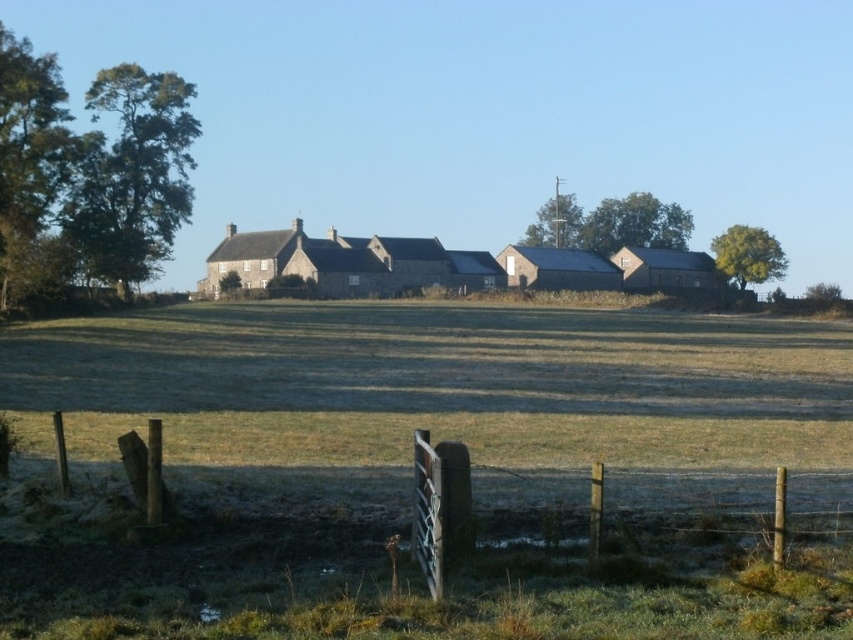
You are standing in the field looking at the farmhouse. There are two points marked in the image. Which point, point (624, 522) or point (349, 268), is closer to you?

Point (624, 522) is closer to the viewer than point (349, 268).

You are standing at the entrance of the wooden gate at center. Looking towards the large stone building, which direction should you walk to reach the building?

Since the wooden gate at center is positioned at point (607, 508), you should walk towards the large stone building by moving forward as the building is in front of you in the scene.